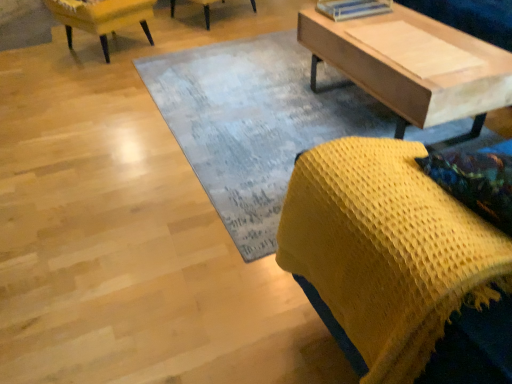
You are a GUI agent. You are given a task and a screenshot of the screen. Output one action in this format:
    pyautogui.click(x=<x>, y=<y>)
    Task: Click on the free space above textured gray rug at center (from a real-world perspective)
    
    Given the screenshot: What is the action you would take?
    pyautogui.click(x=272, y=112)